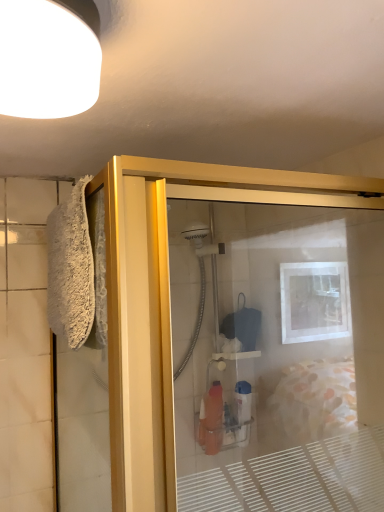
Question: Is the depth of gold metallic shower door at left greater than that of white matte light fixture at upper left?

Choices:
 (A) no
 (B) yes

Answer: (B)

Question: Can you confirm if gold metallic shower door at left is bigger than white matte light fixture at upper left?

Choices:
 (A) yes
 (B) no

Answer: (A)

Question: Is gold metallic shower door at left not near white matte light fixture at upper left?

Choices:
 (A) no
 (B) yes

Answer: (A)

Question: Is gold metallic shower door at left surrounding white matte light fixture at upper left?

Choices:
 (A) yes
 (B) no

Answer: (B)

Question: Does gold metallic shower door at left have a greater height compared to white matte light fixture at upper left?

Choices:
 (A) yes
 (B) no

Answer: (A)

Question: Is gold metallic shower door at left thinner than white matte light fixture at upper left?

Choices:
 (A) no
 (B) yes

Answer: (A)

Question: Does white fluffy bath towel at left touch white matte light fixture at upper left?

Choices:
 (A) yes
 (B) no

Answer: (B)

Question: Is white fluffy bath towel at left not inside white matte light fixture at upper left?

Choices:
 (A) no
 (B) yes

Answer: (B)

Question: From a real-world perspective, is white fluffy bath towel at left below white matte light fixture at upper left?

Choices:
 (A) no
 (B) yes

Answer: (B)

Question: Is white matte light fixture at upper left completely or partially inside white fluffy bath towel at left?

Choices:
 (A) yes
 (B) no

Answer: (B)

Question: Considering the relative positions of white fluffy bath towel at left and white matte light fixture at upper left in the image provided, is white fluffy bath towel at left behind white matte light fixture at upper left?

Choices:
 (A) yes
 (B) no

Answer: (A)

Question: Considering the relative sizes of white fluffy bath towel at left and white matte light fixture at upper left in the image provided, is white fluffy bath towel at left wider than white matte light fixture at upper left?

Choices:
 (A) yes
 (B) no

Answer: (B)

Question: From a real-world perspective, does white fluffy bath towel at left sit lower than gold metallic shower door at left?

Choices:
 (A) no
 (B) yes

Answer: (A)